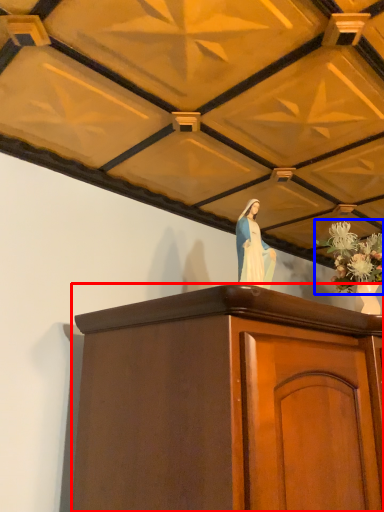
Question: Among these objects, which one is farthest to the camera, furniture (highlighted by a red box) or floral arrangement (highlighted by a blue box)?

Choices:
 (A) furniture
 (B) floral arrangement

Answer: (B)